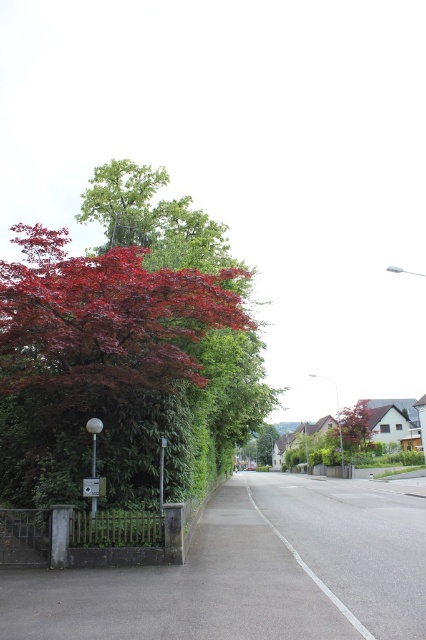
Question: Which is farther from the smooth red tree at right?

Choices:
 (A) glossy red maple tree at left
 (B) metallic gray street sign at lower left

Answer: (B)

Question: Estimate the real-world distances between objects in this image. Which object is closer to the glossy red maple tree at left?

Choices:
 (A) smooth red tree at right
 (B) metallic gray street sign at lower left

Answer: (B)

Question: Is smooth red tree at right positioned behind metallic gray street sign at lower left?

Choices:
 (A) no
 (B) yes

Answer: (B)

Question: Which point is farther to the camera?

Choices:
 (A) glossy red maple tree at left
 (B) metallic gray street sign at lower left
 (C) smooth red tree at right

Answer: (C)

Question: Can you confirm if glossy red maple tree at left is bigger than smooth red tree at right?

Choices:
 (A) no
 (B) yes

Answer: (A)

Question: Does glossy red maple tree at left appear on the right side of metallic gray street sign at lower left?

Choices:
 (A) yes
 (B) no

Answer: (A)